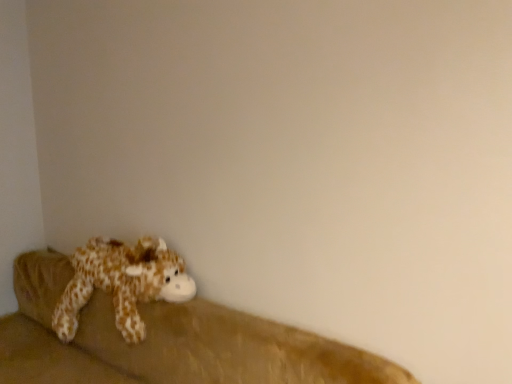
Question: Is brown plush couch at lower left to the left or to the right of fluffy brown plush giraffe at lower left in the image?

Choices:
 (A) left
 (B) right

Answer: (B)

Question: Is brown plush couch at lower left wider or thinner than fluffy brown plush giraffe at lower left?

Choices:
 (A) thin
 (B) wide

Answer: (B)

Question: From their relative heights in the image, would you say brown plush couch at lower left is taller or shorter than fluffy brown plush giraffe at lower left?

Choices:
 (A) short
 (B) tall

Answer: (B)

Question: Based on their sizes in the image, would you say fluffy brown plush giraffe at lower left is bigger or smaller than brown plush couch at lower left?

Choices:
 (A) big
 (B) small

Answer: (B)

Question: Relative to brown plush couch at lower left, is fluffy brown plush giraffe at lower left in front or behind?

Choices:
 (A) front
 (B) behind

Answer: (B)

Question: From their relative heights in the image, would you say fluffy brown plush giraffe at lower left is taller or shorter than brown plush couch at lower left?

Choices:
 (A) tall
 (B) short

Answer: (B)

Question: From a real-world perspective, is fluffy brown plush giraffe at lower left positioned above or below brown plush couch at lower left?

Choices:
 (A) below
 (B) above

Answer: (B)